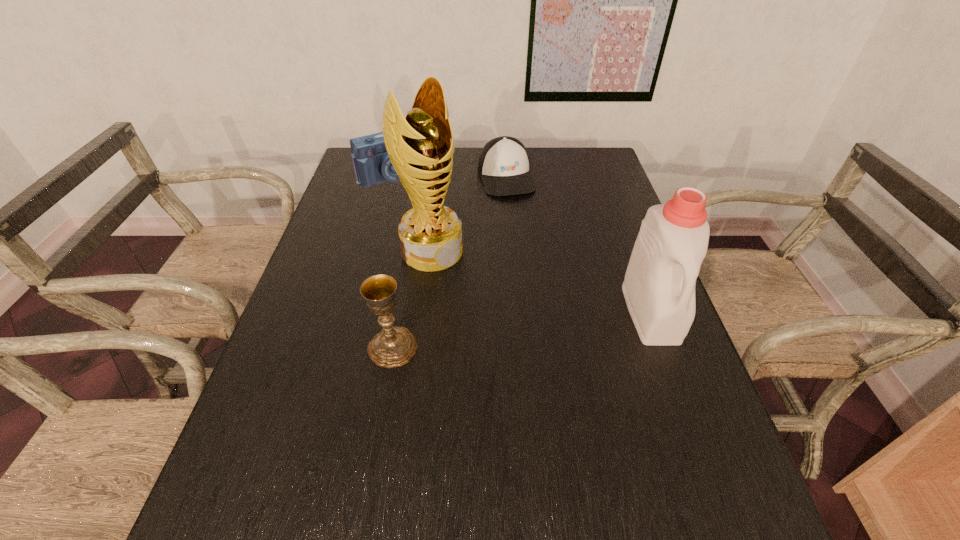
This screenshot has height=540, width=960. Find the location of `free space on the desktop that is between the chalice and the rightmost object and is positioned on the front-facing side of the third farthest object`. free space on the desktop that is between the chalice and the rightmost object and is positioned on the front-facing side of the third farthest object is located at coordinates (525, 329).

Identify the location of vacant space on the desktop that is between the chalice and the second tallest object and is positioned on the front panel of the cap. The width and height of the screenshot is (960, 540). (562, 324).

You are a GUI agent. You are given a task and a screenshot of the screen. Output one action in this format:
    pyautogui.click(x=<x>, y=<y>)
    Task: Click on the free space on the desktop that is between the third tallest object and the second tallest object and is positioned on the lens of the second shortest object
    The image size is (960, 540).
    Given the screenshot: What is the action you would take?
    pyautogui.click(x=515, y=330)